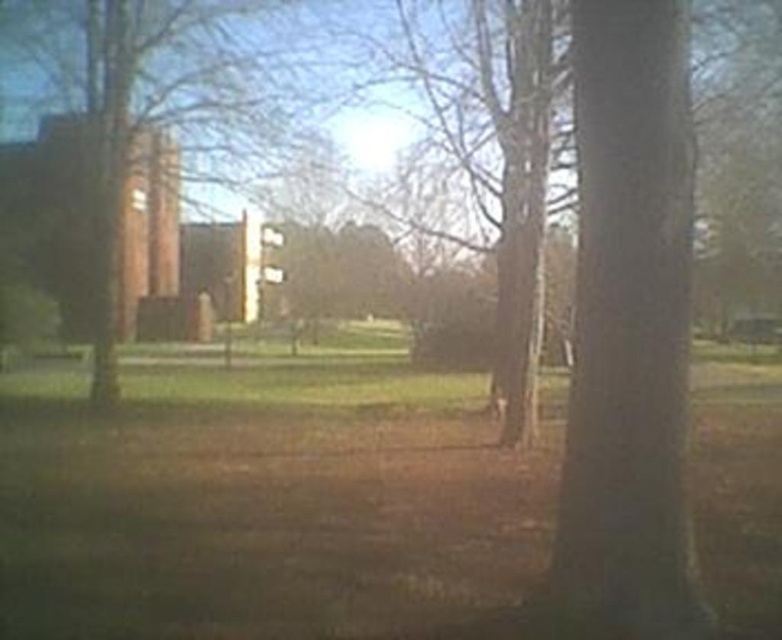
You are standing at the point marked as point (264, 499) and want to walk towards the building with a brick facade on the left. Is the green grass at center in your path?

The green grass at center is located at point (264, 499), so it is in your path towards the building with a brick facade on the left.

You are standing in the middle of the lawn and see the smooth bark tree at center and the brown wood tree at left. Which tree is closer to you?

The smooth bark tree at center is closer to you because it is positioned below the brown wood tree at left, indicating it is in a lower plane and thus nearer in the scene.